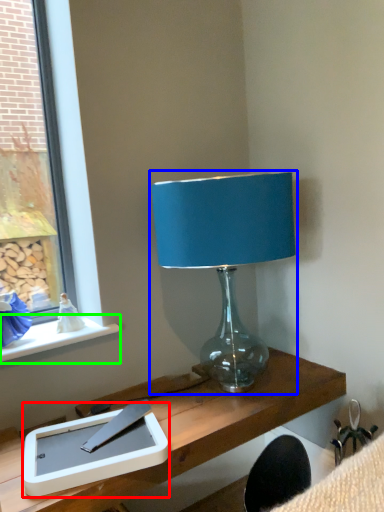
Question: Which object is the farthest from tablet computer (highlighted by a red box)? Choose among these: lamp (highlighted by a blue box) or window sill (highlighted by a green box).

Choices:
 (A) lamp
 (B) window sill

Answer: (A)